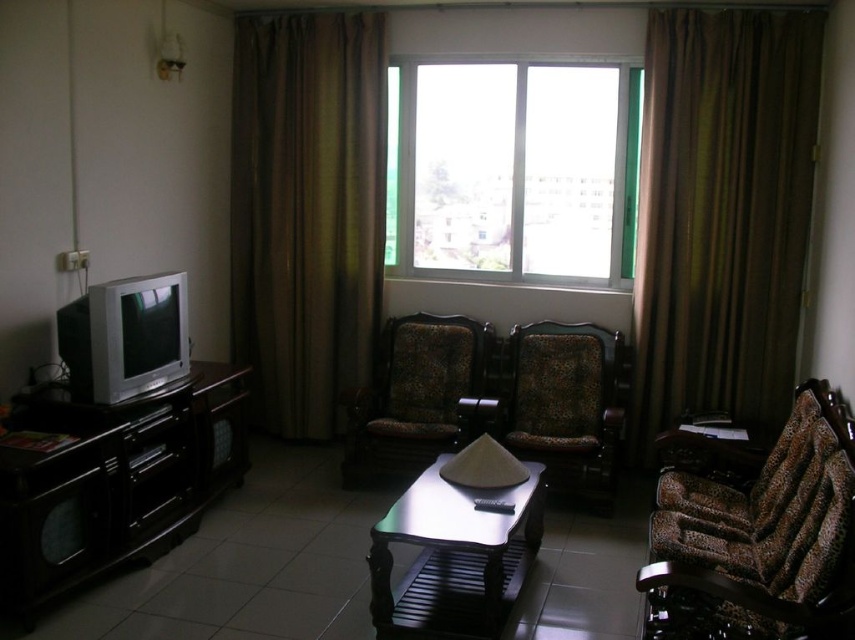
How far apart are transparent glass window at center and leopard print fabric armchair at center?

transparent glass window at center and leopard print fabric armchair at center are 35.18 inches apart from each other.

Can you confirm if transparent glass window at center is thinner than leopard print fabric armchair at center?

No, transparent glass window at center is not thinner than leopard print fabric armchair at center.

Which is in front, point (621, 132) or point (540, 408)?

Point (540, 408) is more forward.

Identify the location of transparent glass window at center. (513, 170).

Is brown leopard print armchair at lower right bigger than patterned fabric armchair at center?

Yes.

Can you confirm if brown leopard print armchair at lower right is positioned above patterned fabric armchair at center?

Actually, brown leopard print armchair at lower right is below patterned fabric armchair at center.

Locate an element on the screen. This screenshot has width=855, height=640. brown leopard print armchair at lower right is located at coordinates (758, 541).

Does brown textured curtain at center have a greater height compared to metallic silver table at center?

Correct, brown textured curtain at center is much taller as metallic silver table at center.

Which is in front, point (245, 316) or point (435, 506)?

Point (435, 506) is more forward.

This screenshot has height=640, width=855. What do you see at coordinates (305, 211) in the screenshot?
I see `brown textured curtain at center` at bounding box center [305, 211].

At what (x,y) coordinates should I click in order to perform the action: click on brown textured curtain at center. Please return your answer as a coordinate pair (x, y). This screenshot has width=855, height=640. Looking at the image, I should click on (x=305, y=211).